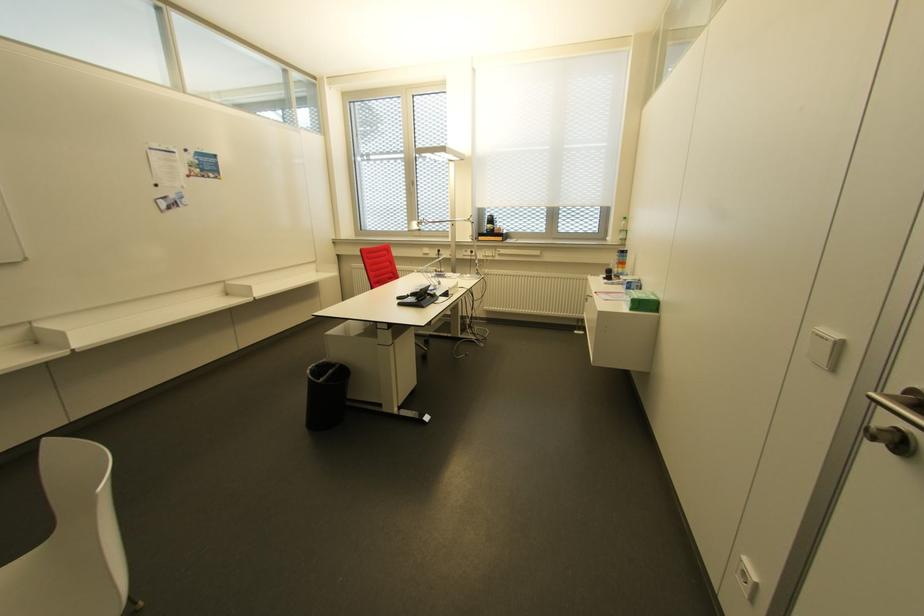
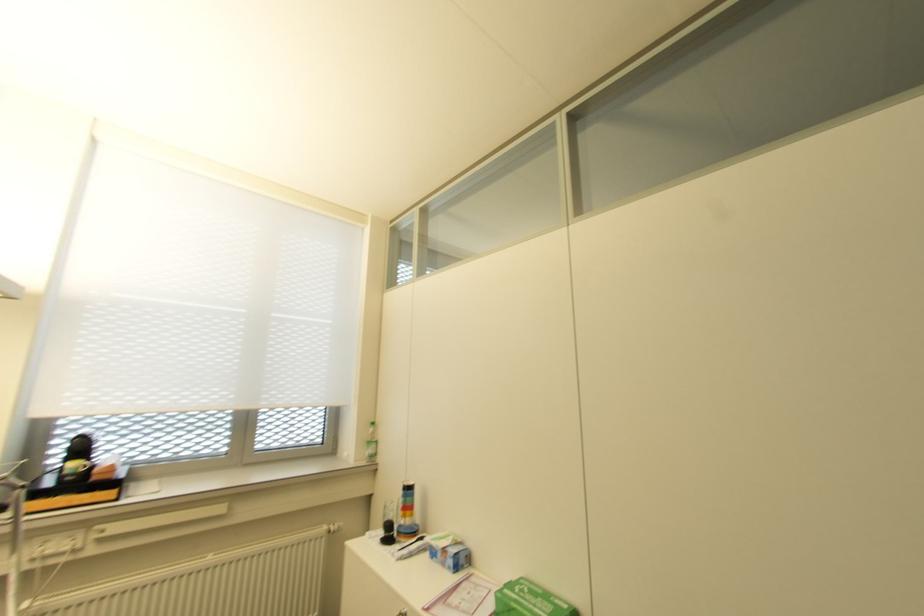
Find the pixel in the second image that matches (605,278) in the first image.

(385, 540)